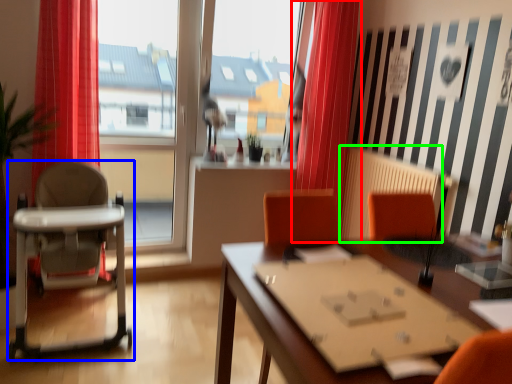
Question: Based on their relative distances, which object is nearer to curtain (highlighted by a red box)? Choose from chair (highlighted by a blue box) and radiator (highlighted by a green box).

Choices:
 (A) chair
 (B) radiator

Answer: (B)